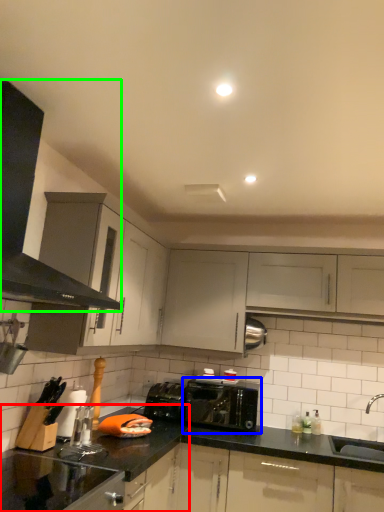
Question: Considering the real-world distances, which object is closest to countertop (highlighted by a red box)? toaster (highlighted by a blue box) or exhaust hood (highlighted by a green box).

Choices:
 (A) toaster
 (B) exhaust hood

Answer: (A)